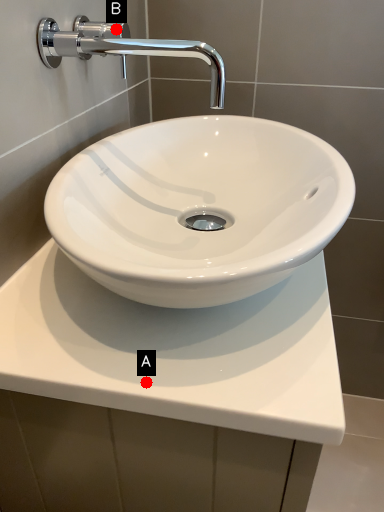
Question: Two points are circled on the image, labeled by A and B beside each circle. Which point appears farthest from the camera in this image?

Choices:
 (A) A is further
 (B) B is further

Answer: (B)